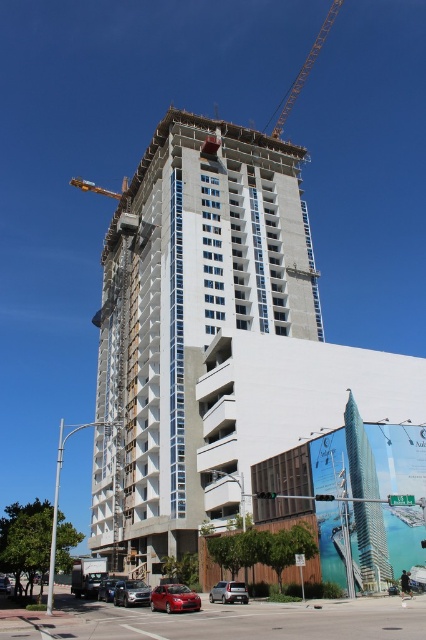
Question: Can you confirm if concrete at center is positioned to the right of shiny red sedan at lower left?

Choices:
 (A) yes
 (B) no

Answer: (B)

Question: Which of the following is the closest to the observer?

Choices:
 (A) (210, 332)
 (B) (109, 602)

Answer: (B)

Question: Which object is farther from the camera taking this photo?

Choices:
 (A) shiny black sedan at lower left
 (B) silver metallic sedan at lower center

Answer: (A)

Question: Which of the following is the closest to the observer?

Choices:
 (A) (115, 600)
 (B) (85, 188)
 (C) (175, 609)
 (D) (293, 195)

Answer: (C)

Question: Can you confirm if metallic yellow crane at upper center is positioned to the left of yellow metallic crane at upper center?

Choices:
 (A) no
 (B) yes

Answer: (A)

Question: Does metallic yellow crane at upper center appear under shiny red sedan at lower left?

Choices:
 (A) yes
 (B) no

Answer: (B)